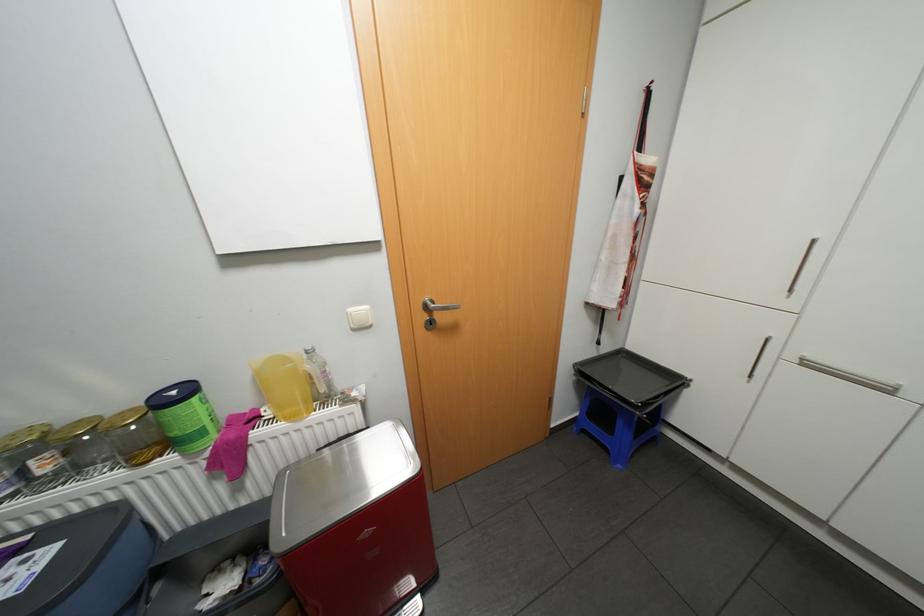
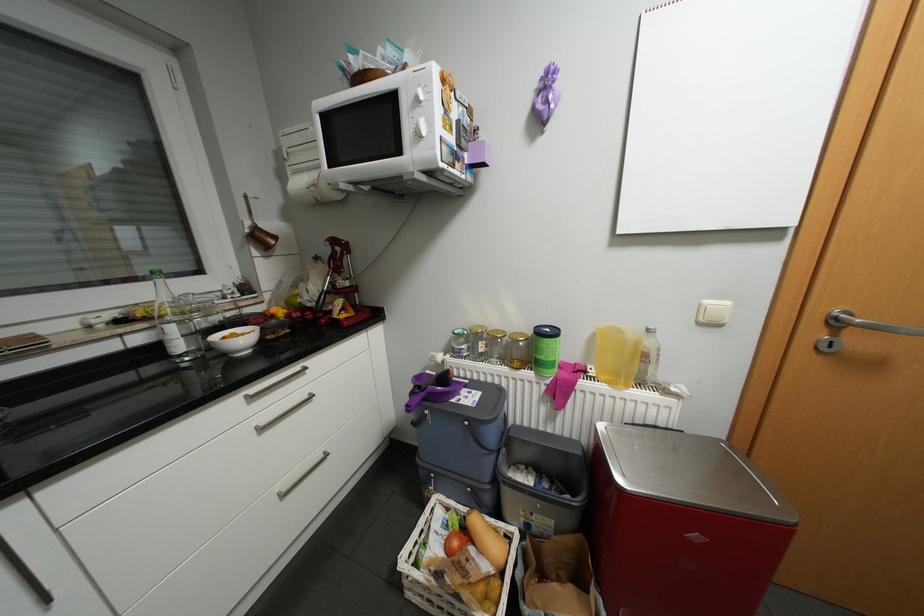
The point at [190,453] is marked in the first image. Where is the corresponding point in the second image?

(544, 373)